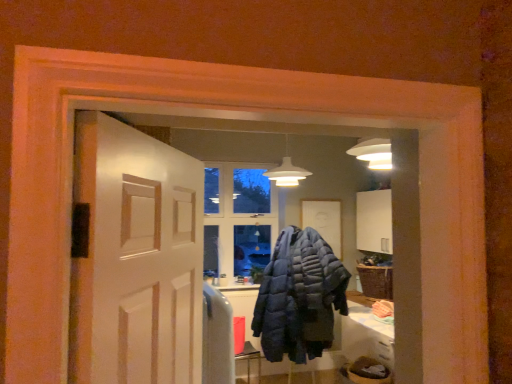
What do you see at coordinates (134, 257) in the screenshot? This screenshot has height=384, width=512. I see `white glossy door at center` at bounding box center [134, 257].

In the scene shown: In order to face white glossy door at center, should I rotate leftwards or rightwards?

To align with it, rotate left about 7.785°.

The width and height of the screenshot is (512, 384). In order to click on white glossy door at center in this screenshot , I will do `click(134, 257)`.

Measure the distance between dark blue quilted jacket at center and camera.

dark blue quilted jacket at center is 12.31 feet from camera.

Consider the image. What is the approximate width of dark blue quilted jacket at center?

dark blue quilted jacket at center is 31.04 inches in width.

The image size is (512, 384). What are the coordinates of `dark blue quilted jacket at center` in the screenshot? It's located at (298, 297).

What do you see at coordinates (298, 297) in the screenshot? This screenshot has width=512, height=384. I see `dark blue quilted jacket at center` at bounding box center [298, 297].

This screenshot has height=384, width=512. In order to click on white glossy door at center in this screenshot , I will do `click(134, 257)`.

Visually, is white glossy door at center positioned to the left or to the right of dark blue quilted jacket at center?

Based on their positions, white glossy door at center is located to the left of dark blue quilted jacket at center.

Which is behind, white glossy door at center or dark blue quilted jacket at center?

dark blue quilted jacket at center is behind.

Considering the points (160, 187) and (319, 356), which point is behind, point (160, 187) or point (319, 356)?

Point (319, 356)

From the image's perspective, which object appears higher, white glossy door at center or dark blue quilted jacket at center?

white glossy door at center, from the image's perspective.

From a real-world perspective, is white glossy door at center positioned above or below dark blue quilted jacket at center?

white glossy door at center is above dark blue quilted jacket at center.

Is white glossy door at center wider than dark blue quilted jacket at center?

In fact, white glossy door at center might be narrower than dark blue quilted jacket at center.

From their relative heights in the image, would you say white glossy door at center is taller or shorter than dark blue quilted jacket at center?

white glossy door at center is shorter than dark blue quilted jacket at center.

Does white glossy door at center have a larger size compared to dark blue quilted jacket at center?

No, white glossy door at center is not bigger than dark blue quilted jacket at center.

Is dark blue quilted jacket at center completely or partially inside white glossy door at center?

That's incorrect, dark blue quilted jacket at center is not inside white glossy door at center.

Based on the photo, is there a large distance between white glossy door at center and dark blue quilted jacket at center?

white glossy door at center is positioned a significant distance from dark blue quilted jacket at center.

Is white glossy door at center looking in the opposite direction of dark blue quilted jacket at center?

That's not correct — white glossy door at center is not looking away from dark blue quilted jacket at center.

How different are the orientations of white glossy door at center and dark blue quilted jacket at center in degrees?

They differ by 54.7 degrees in their facing directions.

Locate an element on the screen. door in front of the dark blue quilted jacket at center is located at coordinates (134, 257).

Visually, is dark blue quilted jacket at center positioned to the left or to the right of white glossy door at center?

Clearly, dark blue quilted jacket at center is on the right of white glossy door at center in the image.

Is dark blue quilted jacket at center closer to camera compared to white glossy door at center?

No, the depth of dark blue quilted jacket at center is greater than that of white glossy door at center.

Which is closer, (302, 324) or (163, 371)?

Point (302, 324) appears to be farther away from the viewer than point (163, 371).

From the image's perspective, which one is positioned higher, dark blue quilted jacket at center or white glossy door at center?

white glossy door at center, from the image's perspective.

From a real-world perspective, who is located lower, dark blue quilted jacket at center or white glossy door at center?

dark blue quilted jacket at center, from a real-world perspective.

Is dark blue quilted jacket at center thinner than white glossy door at center?

No, dark blue quilted jacket at center is not thinner than white glossy door at center.

Considering the relative sizes of dark blue quilted jacket at center and white glossy door at center in the image provided, is dark blue quilted jacket at center taller than white glossy door at center?

Indeed, dark blue quilted jacket at center has a greater height compared to white glossy door at center.

Can you confirm if dark blue quilted jacket at center is smaller than white glossy door at center?

No.

Is dark blue quilted jacket at center not within white glossy door at center?

dark blue quilted jacket at center lies outside white glossy door at center's area.

Is dark blue quilted jacket at center in contact with white glossy door at center?

No, dark blue quilted jacket at center is not making contact with white glossy door at center.

Consider the image. Does dark blue quilted jacket at center turn towards white glossy door at center?

No, dark blue quilted jacket at center is not aimed at white glossy door at center.

What's the angular difference between dark blue quilted jacket at center and white glossy door at center's facing directions?

They differ by 54.7 degrees in their facing directions.

The image size is (512, 384). Identify the location of jacket located on the right of white glossy door at center. coord(298,297).

In the image, there is a white glossy door at center. What are the coordinates of `jacket below it (from the image's perspective)` in the screenshot? It's located at (298, 297).

At what (x,y) coordinates should I click in order to perform the action: click on door in front of the dark blue quilted jacket at center. Please return your answer as a coordinate pair (x, y). This screenshot has height=384, width=512. Looking at the image, I should click on (134, 257).